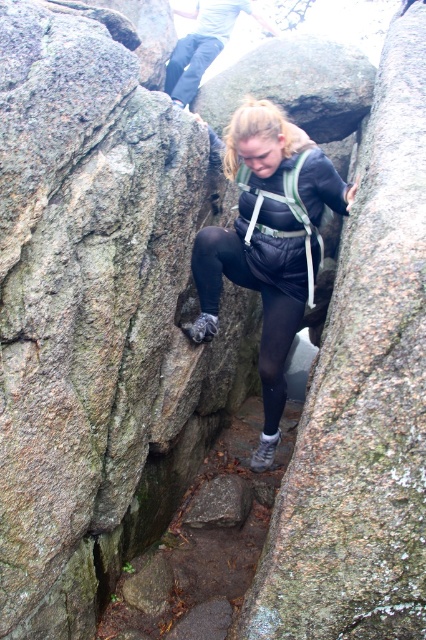
Question: From the image, what is the correct spatial relationship of black matte jumpsuit at center in relation to matte gray pants at upper center?

Choices:
 (A) below
 (B) above

Answer: (A)

Question: Which of the following is the closest to the observer?

Choices:
 (A) black matte jumpsuit at center
 (B) matte gray pants at upper center

Answer: (A)

Question: Which of the following is the farthest from the observer?

Choices:
 (A) matte gray pants at upper center
 (B) black matte jumpsuit at center

Answer: (A)

Question: Is black matte jumpsuit at center smaller than matte gray pants at upper center?

Choices:
 (A) yes
 (B) no

Answer: (A)

Question: Which of the following is the closest to the observer?

Choices:
 (A) (186, 104)
 (B) (215, 241)
 (C) (276, 342)

Answer: (B)

Question: Is black matte jumpsuit at center wider than black matte leggings at center?

Choices:
 (A) no
 (B) yes

Answer: (B)